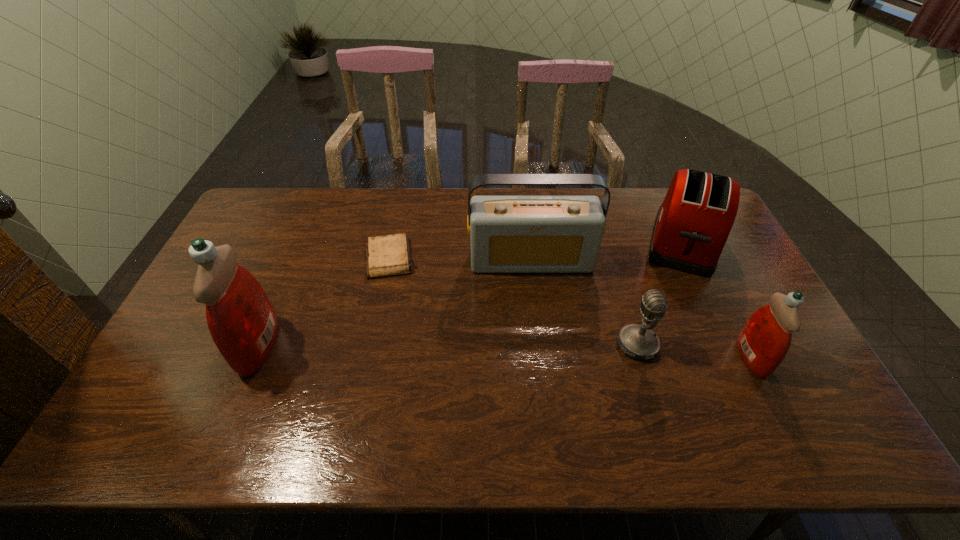
Where is `the leftmost object`? Image resolution: width=960 pixels, height=540 pixels. the leftmost object is located at coordinates 242,322.

At what (x,y) coordinates should I click in order to perform the action: click on the taller detergent. Please return your answer as a coordinate pair (x, y). This screenshot has width=960, height=540. Looking at the image, I should click on (242, 322).

I want to click on the right detergent, so click(765, 339).

This screenshot has height=540, width=960. I want to click on radio receiver, so click(508, 234).

What are the coordinates of `the second tallest object` in the screenshot? It's located at click(508, 234).

I want to click on toaster, so click(x=692, y=225).

This screenshot has width=960, height=540. In order to click on the fifth tallest object in this screenshot , I will do `click(639, 342)`.

Locate an element on the screen. This screenshot has width=960, height=540. the third object from right to left is located at coordinates (639, 342).

Where is `the shortest object`? Image resolution: width=960 pixels, height=540 pixels. the shortest object is located at coordinates (386, 256).

Find the location of a particular element. diary is located at coordinates (386, 256).